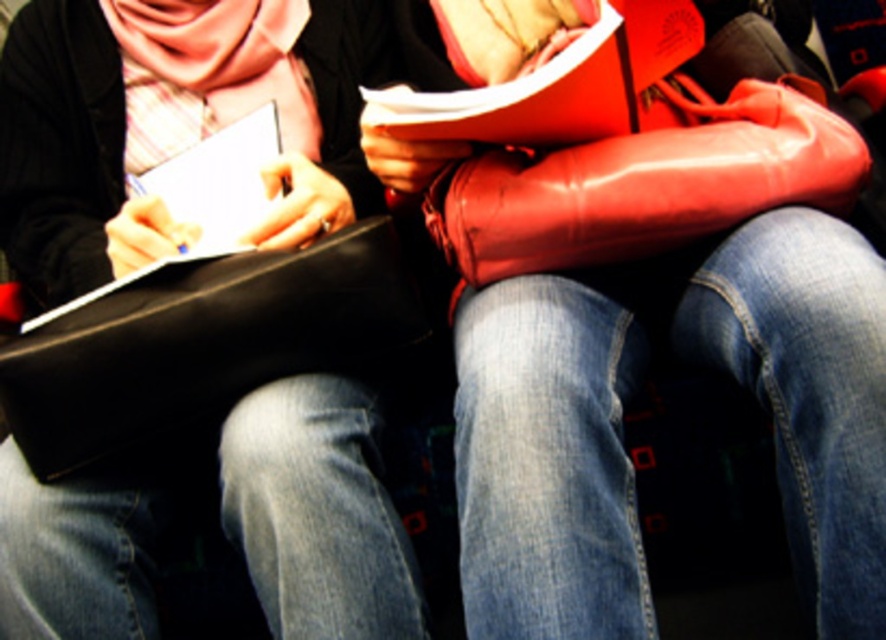
Looking at this image, you are organizing a backpack cleanup event and need to place the matte black bag at center and the black leather bag at lower left into storage. According to the image, which bag should be placed to the right side of the storage shelf?

The black leather bag at lower left should be placed to the right side of the storage shelf because the matte black bag at center is to the left of it in the image.

You are standing in a lecture hall and see the matte black bag at center. Can you estimate where it is located in terms of coordinates?

The matte black bag at center is located at coordinates point (175, 122).

You are organizing a backpack for a school trip and have two bags in front of you. The matte black bag at center and the rubberized red bag at center. Which bag should you choose if you need to carry more items?

The matte black bag at center is bigger than the rubberized red bag at center, so you should choose the matte black bag at center to carry more items.